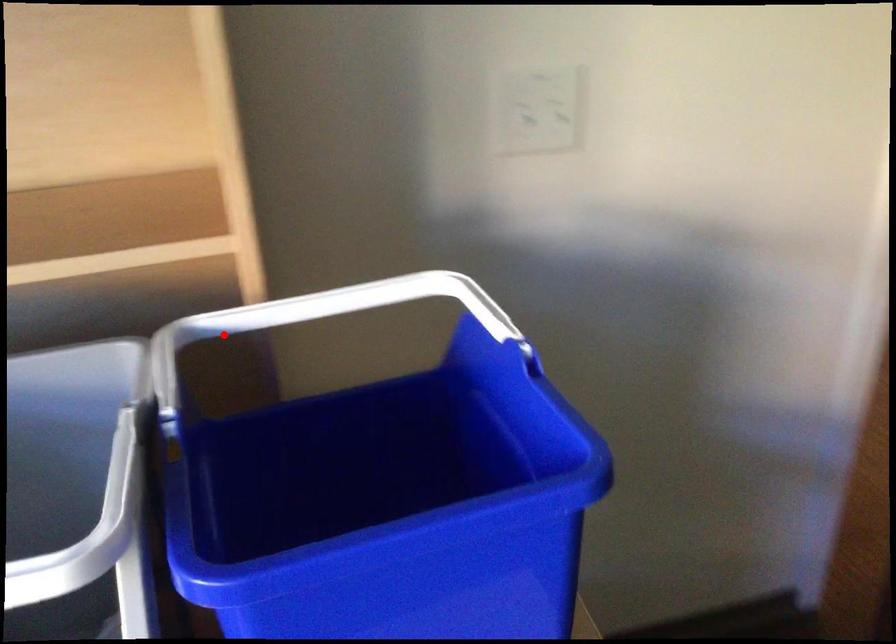
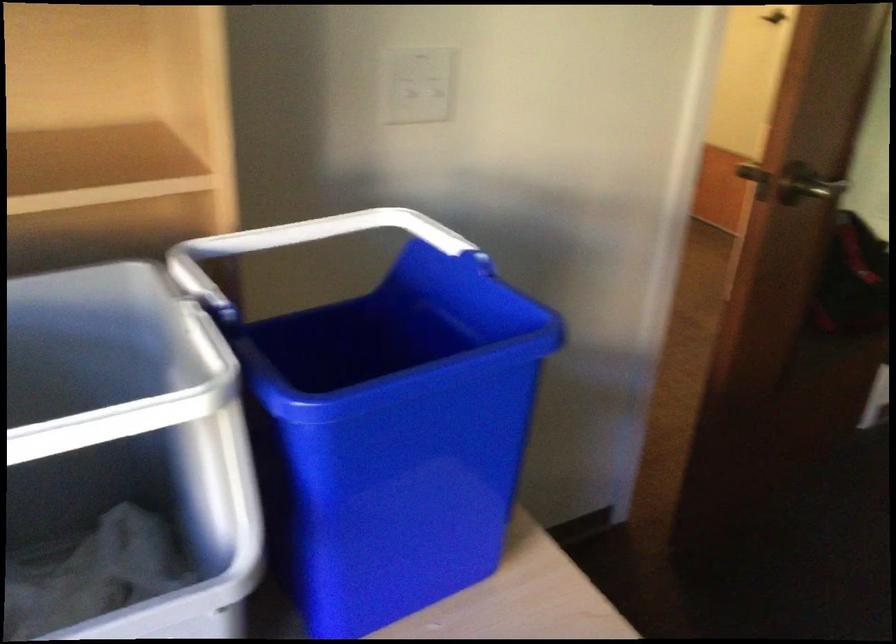
Question: A red point is marked in image1. In image2, is the corresponding 3D point closer to the camera or farther? Reply with the corresponding letter.

Choices:
 (A) The corresponding 3D point is closer.
 (B) The corresponding 3D point is farther.

Answer: (B)